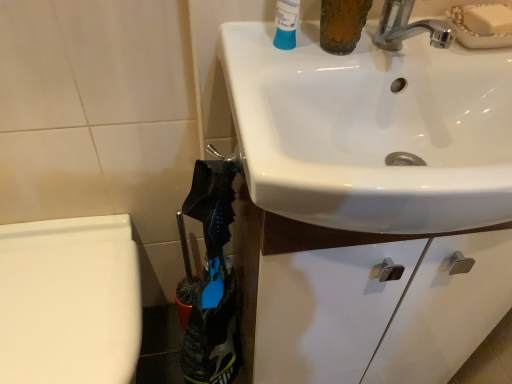
Question: Is white glossy sink at upper right completely or partially outside of white glossy bidet at lower left?

Choices:
 (A) yes
 (B) no

Answer: (A)

Question: Is white glossy bidet at lower left inside white glossy sink at upper right?

Choices:
 (A) yes
 (B) no

Answer: (B)

Question: Is white glossy sink at upper right facing away from white glossy bidet at lower left?

Choices:
 (A) yes
 (B) no

Answer: (B)

Question: From the image's perspective, is white glossy sink at upper right on white glossy bidet at lower left?

Choices:
 (A) yes
 (B) no

Answer: (A)

Question: Is white glossy sink at upper right directly adjacent to white glossy bidet at lower left?

Choices:
 (A) no
 (B) yes

Answer: (A)

Question: Are white glossy sink at upper right and white glossy bidet at lower left far apart?

Choices:
 (A) yes
 (B) no

Answer: (B)

Question: From a real-world perspective, is white glossy bidet at lower left on white glossy sink at upper right?

Choices:
 (A) no
 (B) yes

Answer: (A)

Question: Is white glossy bidet at lower left thinner than white glossy sink at upper right?

Choices:
 (A) no
 (B) yes

Answer: (B)

Question: Would you consider white glossy bidet at lower left to be distant from white glossy sink at upper right?

Choices:
 (A) yes
 (B) no

Answer: (B)

Question: Is white glossy bidet at lower left looking in the opposite direction of white glossy sink at upper right?

Choices:
 (A) no
 (B) yes

Answer: (A)

Question: Considering the relative sizes of white glossy bidet at lower left and white glossy sink at upper right in the image provided, is white glossy bidet at lower left bigger than white glossy sink at upper right?

Choices:
 (A) yes
 (B) no

Answer: (A)

Question: Is white glossy bidet at lower left facing towards white glossy sink at upper right?

Choices:
 (A) no
 (B) yes

Answer: (A)

Question: From a real-world perspective, is white glossy sink at upper right above or below white glossy bidet at lower left?

Choices:
 (A) below
 (B) above

Answer: (B)